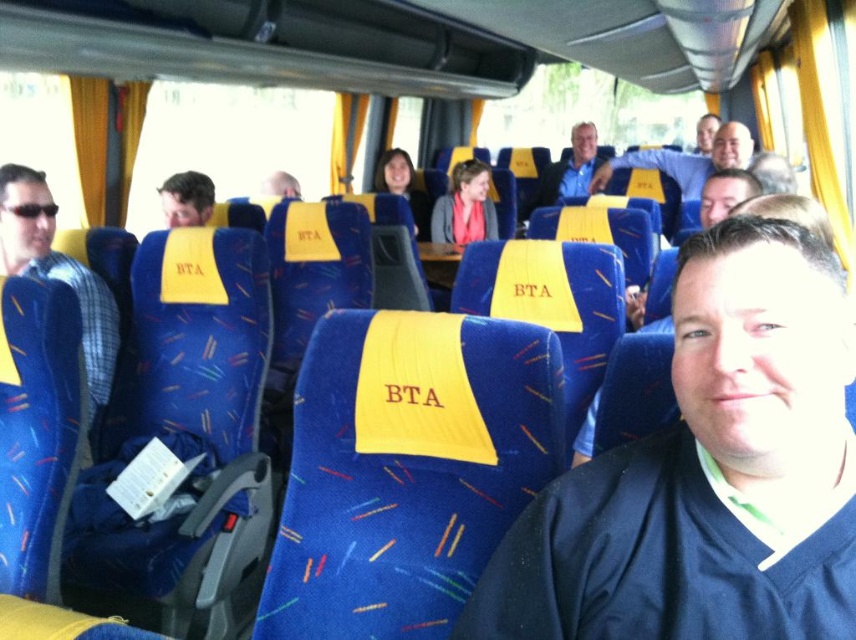
Question: Is plaid fabric shirt at left positioned behind matte blue shirt at center?

Choices:
 (A) no
 (B) yes

Answer: (A)

Question: Which object is farther from the camera taking this photo?

Choices:
 (A) matte black hair at upper center
 (B) blue fabric seat at center

Answer: (B)

Question: Estimate the real-world distances between objects in this image. Which object is farther from the blue fabric seat at center?

Choices:
 (A) white hair at center
 (B) matte black hair at upper center
 (C) matte yellow seat at center

Answer: (B)

Question: Is matte blue shirt at lower right closer to camera compared to matte blue shirt at center?

Choices:
 (A) yes
 (B) no

Answer: (A)

Question: Which object appears farthest from the camera in this image?

Choices:
 (A) matte blue shirt at lower right
 (B) matte blue shirt at center
 (C) matte yellow seat at center
 (D) white hair at center

Answer: (C)

Question: Does matte blue shirt at lower right appear on the left side of matte black hair at upper center?

Choices:
 (A) no
 (B) yes

Answer: (A)